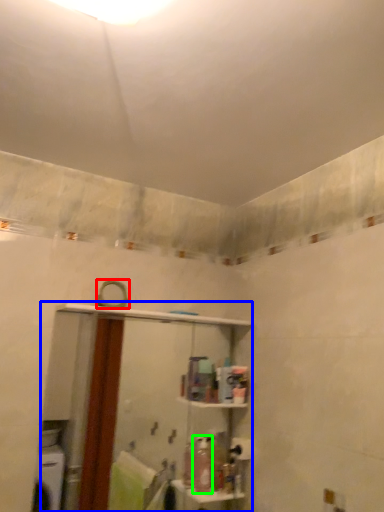
Question: Considering the real-world distances, which object is closest to mirror (highlighted by a red box)? shelf (highlighted by a blue box) or toiletry (highlighted by a green box).

Choices:
 (A) shelf
 (B) toiletry

Answer: (B)